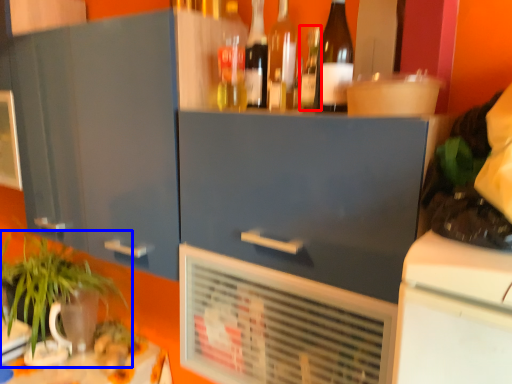
Question: Which point is further to the camera, bottle (highlighted by a red box) or houseplant (highlighted by a blue box)?

Choices:
 (A) bottle
 (B) houseplant

Answer: (B)